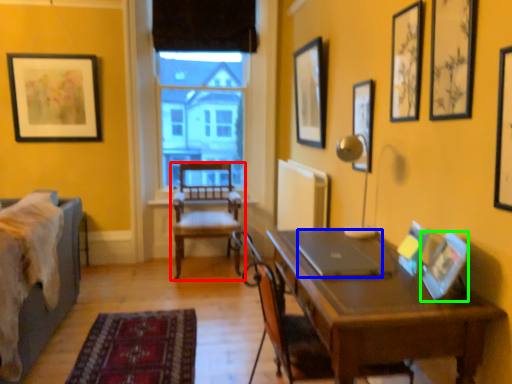
Question: Which is farther away from chair (highlighted by a red box)? laptop (highlighted by a blue box) or picture frame (highlighted by a green box)?

Choices:
 (A) laptop
 (B) picture frame

Answer: (B)